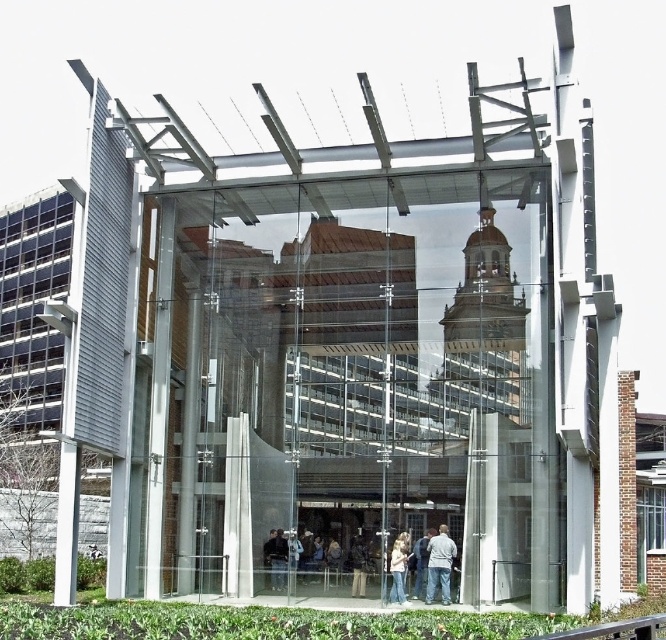
Question: Is transparent glass box at center positioned behind light beige sweater at center?

Choices:
 (A) yes
 (B) no

Answer: (B)

Question: Among these points, which one is farthest from the camera?

Choices:
 (A) (172, 445)
 (B) (448, 568)

Answer: (A)

Question: Which point is farther to the camera?

Choices:
 (A) gray cotton shirt at center
 (B) light beige sweater at center

Answer: (B)

Question: Is transparent glass box at center above light beige sweater at center?

Choices:
 (A) yes
 (B) no

Answer: (A)

Question: Is transparent glass box at center to the right of gray cotton shirt at center from the viewer's perspective?

Choices:
 (A) no
 (B) yes

Answer: (A)

Question: Which point is farther to the camera?

Choices:
 (A) pos(426,593)
 (B) pos(549,547)
 (C) pos(406,552)

Answer: (C)